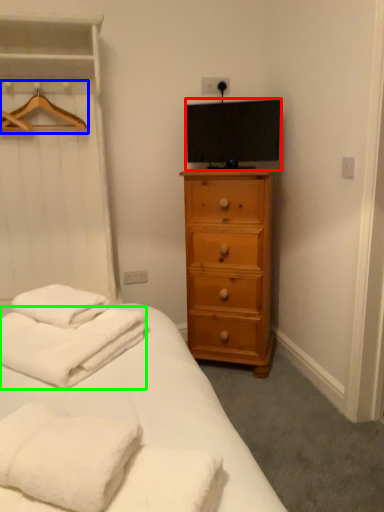
Question: Which is nearer to the television (highlighted by a red box)? hanger (highlighted by a blue box) or bath towel (highlighted by a green box).

Choices:
 (A) hanger
 (B) bath towel

Answer: (A)